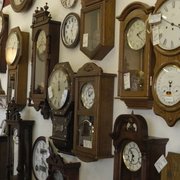
The width and height of the screenshot is (180, 180). What are the coordinates of `bottom side of clocks` in the screenshot? It's located at (25, 4), (71, 5).